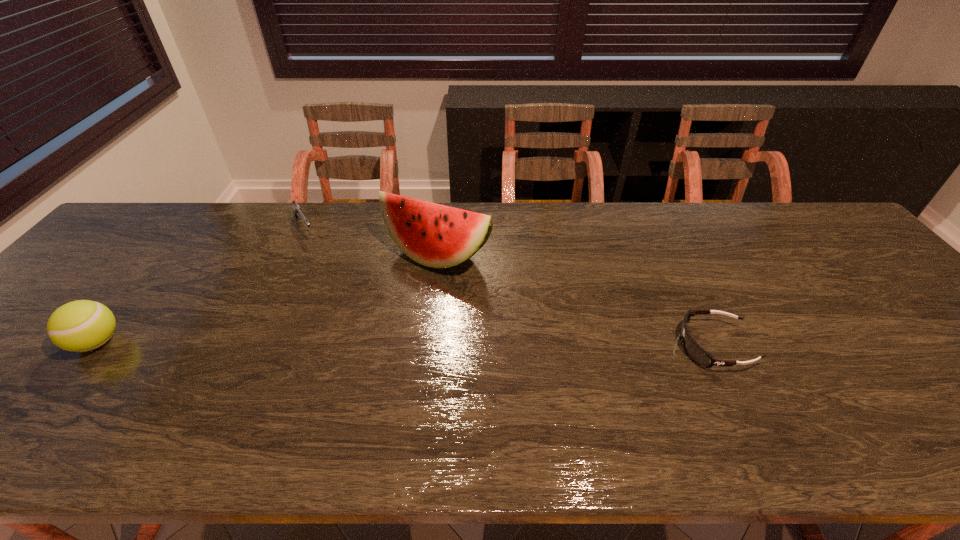
Find the location of a particular element. This screenshot has width=960, height=540. vacant position located on the front and sides of the goggles is located at coordinates (636, 346).

Where is `vacant space situated 0.060m on the front and sides of the goggles`? The width and height of the screenshot is (960, 540). vacant space situated 0.060m on the front and sides of the goggles is located at coordinates (653, 346).

This screenshot has width=960, height=540. I want to click on vacant area situated 0.370m on the outer rind of the tallest object, so click(327, 387).

The image size is (960, 540). What are the coordinates of `vacant space located on the outer rind of the tallest object` in the screenshot? It's located at (364, 340).

You are a GUI agent. You are given a task and a screenshot of the screen. Output one action in this format:
    pyautogui.click(x=<x>, y=<y>)
    Task: Click on the vacant point located on the outer rind of the tallest object
    
    Given the screenshot: What is the action you would take?
    pyautogui.click(x=395, y=301)

Where is `free space located 0.120m on the front-facing side of the third tallest object`? Image resolution: width=960 pixels, height=540 pixels. free space located 0.120m on the front-facing side of the third tallest object is located at coordinates (323, 262).

At what (x,y) coordinates should I click in order to perform the action: click on vacant area situated 0.190m on the front-facing side of the third tallest object. Please return your answer as a coordinate pair (x, y). Looking at the image, I should click on (331, 276).

Find the location of a particular element. This screenshot has width=960, height=540. free space located on the front-facing side of the third tallest object is located at coordinates pyautogui.click(x=344, y=295).

Where is `watermelon that is positioned at the far edge`? This screenshot has height=540, width=960. watermelon that is positioned at the far edge is located at coordinates (434, 235).

At what (x,y) coordinates should I click in order to perform the action: click on pistol that is positioned at the far edge. Please return your answer as a coordinate pair (x, y). This screenshot has width=960, height=540. Looking at the image, I should click on (297, 210).